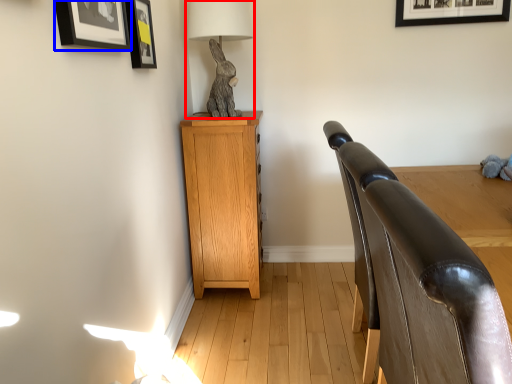
Question: Which point is closer to the camera, table lamp (highlighted by a red box) or picture frame (highlighted by a blue box)?

Choices:
 (A) table lamp
 (B) picture frame

Answer: (B)